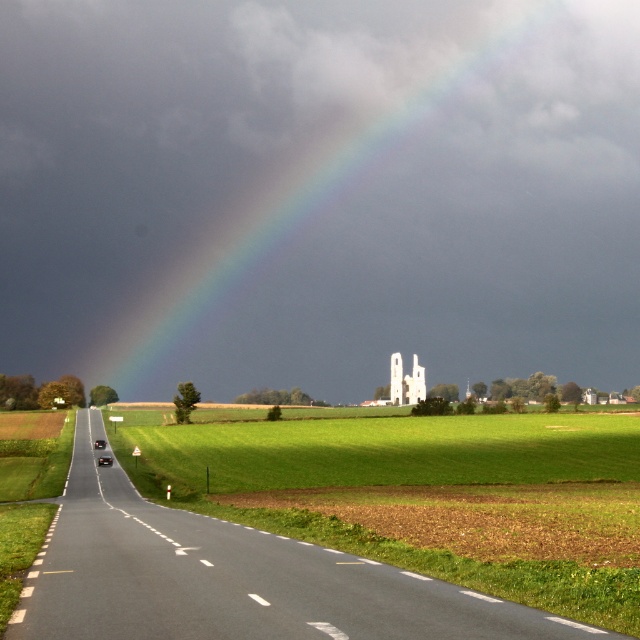
Question: Is black glossy car at center to the right of shiny black sedan at road center from the viewer's perspective?

Choices:
 (A) no
 (B) yes

Answer: (B)

Question: Estimate the real-world distances between objects in this image. Which object is closer to the shiny black sedan at road center?

Choices:
 (A) rainbow at upper center
 (B) black glossy car at center

Answer: (B)

Question: Estimate the real-world distances between objects in this image. Which object is closer to the black glossy car at center?

Choices:
 (A) rainbow at upper center
 (B) shiny black sedan at road center

Answer: (B)

Question: Can you confirm if black glossy car at center is positioned to the left of shiny black sedan at road center?

Choices:
 (A) yes
 (B) no

Answer: (B)

Question: Can you confirm if rainbow at upper center is wider than black glossy car at center?

Choices:
 (A) yes
 (B) no

Answer: (A)

Question: Estimate the real-world distances between objects in this image. Which object is farther from the shiny black sedan at road center?

Choices:
 (A) rainbow at upper center
 (B) black glossy car at center

Answer: (A)